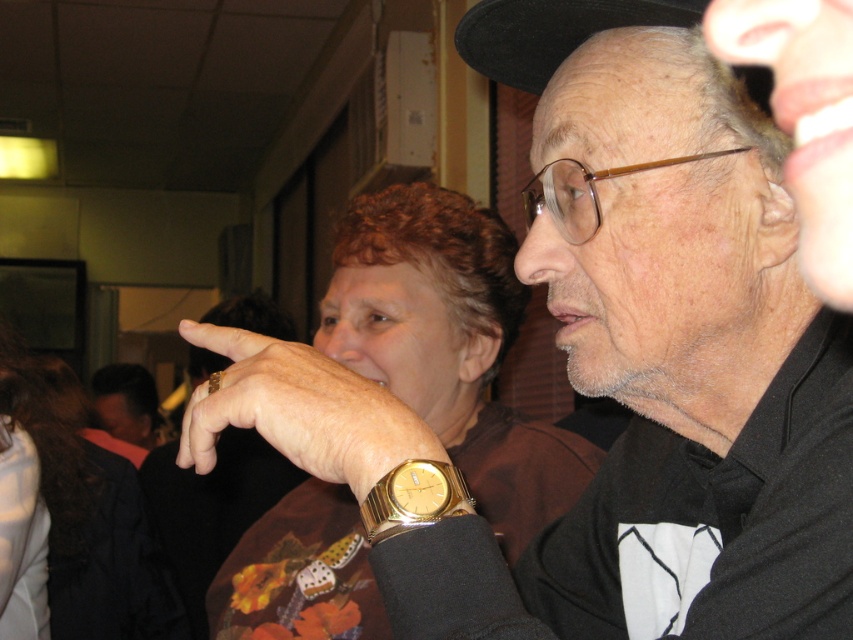
Question: Which of the following is the farthest from the observer?

Choices:
 (A) gold metallic watch at center
 (B) gold metallic watch at lower center
 (C) brown fabric shirt at center

Answer: (C)

Question: Estimate the real-world distances between objects in this image. Which object is farther from the dry skin at ear right?

Choices:
 (A) gold metallic watch at center
 (B) gold metallic watch at lower center
 (C) brown fabric shirt at center

Answer: (C)

Question: Does brown fabric shirt at center appear under gold metallic watch at center?

Choices:
 (A) yes
 (B) no

Answer: (A)

Question: Is dry skin at ear right positioned at the back of gold metallic watch at lower center?

Choices:
 (A) no
 (B) yes

Answer: (B)

Question: Is gold metallic watch at center thinner than dry skin at ear right?

Choices:
 (A) yes
 (B) no

Answer: (B)

Question: Which object appears closest to the camera in this image?

Choices:
 (A) gold metallic watch at center
 (B) gold metallic watch at lower center
 (C) dry skin at ear right

Answer: (B)